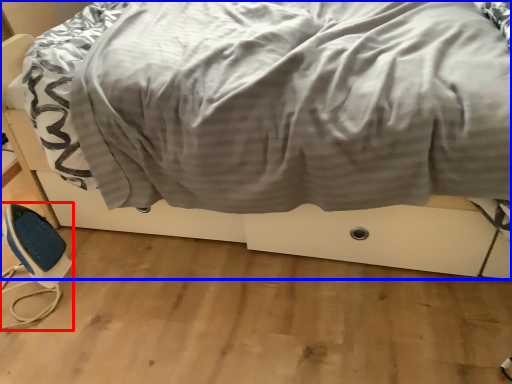
Question: Which object appears farthest to the camera in this image, equipment (highlighted by a red box) or bed (highlighted by a blue box)?

Choices:
 (A) equipment
 (B) bed

Answer: (A)